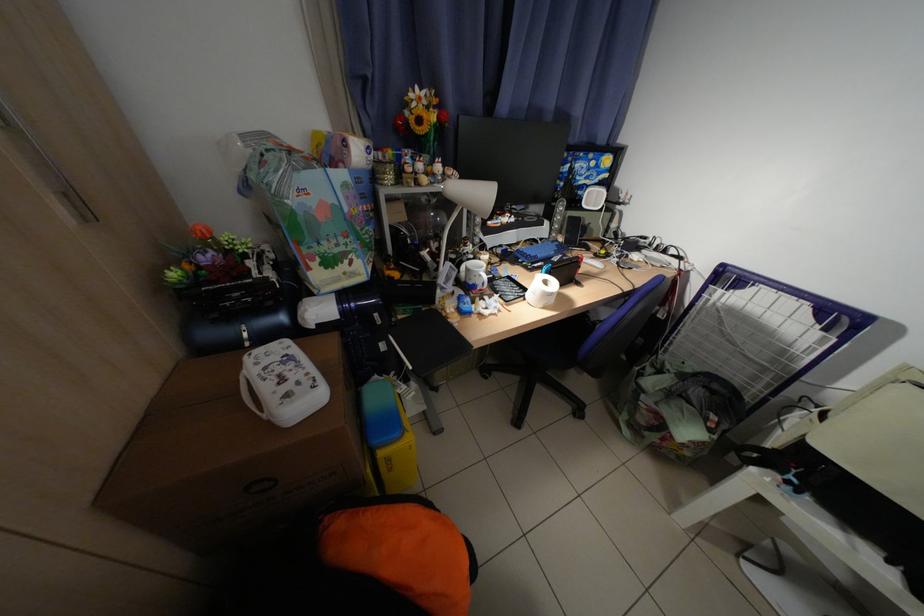
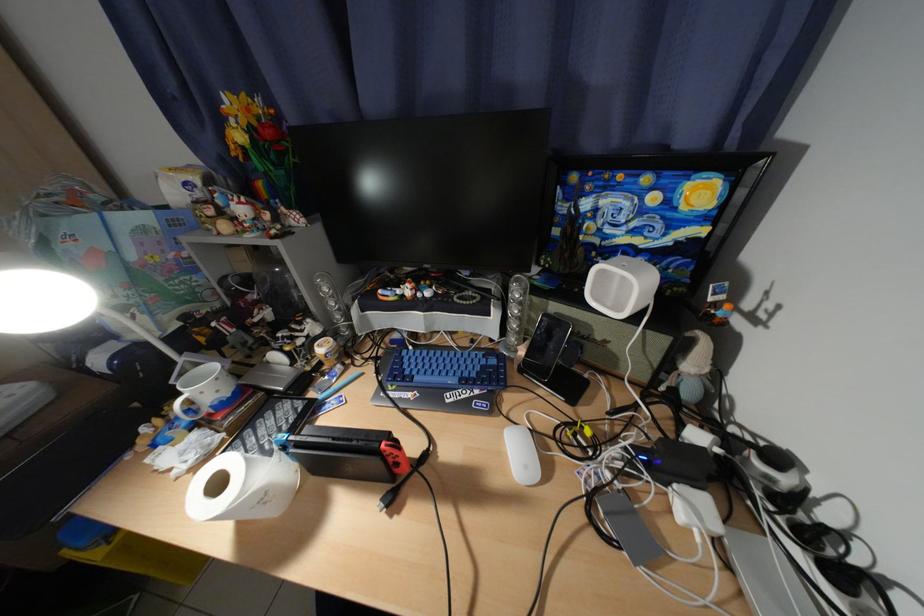
Find the pixel in the second image that matches point (648, 257) in the first image.

(700, 508)